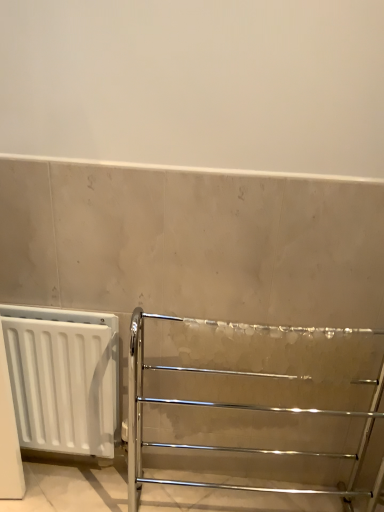
Question: Does polished chrome towel rack at center have a greater height compared to white matte radiator at left?

Choices:
 (A) yes
 (B) no

Answer: (A)

Question: Is white matte radiator at left at the back of polished chrome towel rack at center?

Choices:
 (A) no
 (B) yes

Answer: (A)

Question: Is polished chrome towel rack at center to the right of white matte radiator at left from the viewer's perspective?

Choices:
 (A) yes
 (B) no

Answer: (A)

Question: Considering the relative sizes of polished chrome towel rack at center and white matte radiator at left in the image provided, is polished chrome towel rack at center bigger than white matte radiator at left?

Choices:
 (A) yes
 (B) no

Answer: (A)

Question: Is polished chrome towel rack at center next to white matte radiator at left?

Choices:
 (A) no
 (B) yes

Answer: (A)

Question: Is polished chrome towel rack at center closer to the viewer compared to white matte radiator at left?

Choices:
 (A) yes
 (B) no

Answer: (A)

Question: Does white matte radiator at left have a greater width compared to polished chrome towel rack at center?

Choices:
 (A) no
 (B) yes

Answer: (A)

Question: Can you confirm if white matte radiator at left is thinner than polished chrome towel rack at center?

Choices:
 (A) yes
 (B) no

Answer: (A)

Question: Is white matte radiator at left bigger than polished chrome towel rack at center?

Choices:
 (A) yes
 (B) no

Answer: (B)

Question: Is white matte radiator at left positioned with its back to polished chrome towel rack at center?

Choices:
 (A) yes
 (B) no

Answer: (B)

Question: Does white matte radiator at left have a lesser height compared to polished chrome towel rack at center?

Choices:
 (A) no
 (B) yes

Answer: (B)

Question: Could you tell me if white matte radiator at left is turned towards polished chrome towel rack at center?

Choices:
 (A) yes
 (B) no

Answer: (B)

Question: Considering the positions of point (87, 350) and point (379, 412), is point (87, 350) closer or farther from the camera than point (379, 412)?

Choices:
 (A) closer
 (B) farther

Answer: (A)